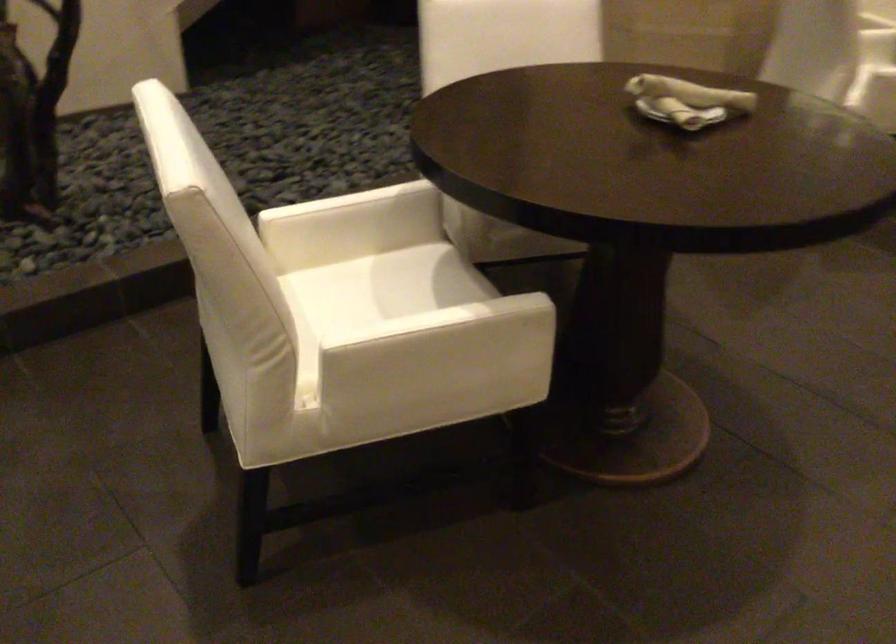
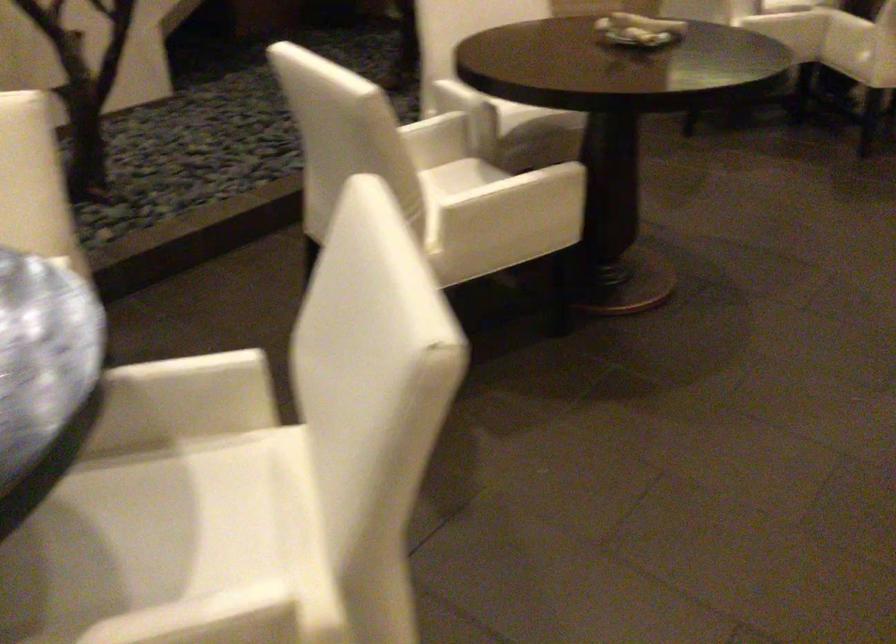
Find the pixel in the second image that matches point (418, 207) in the first image.

(453, 129)